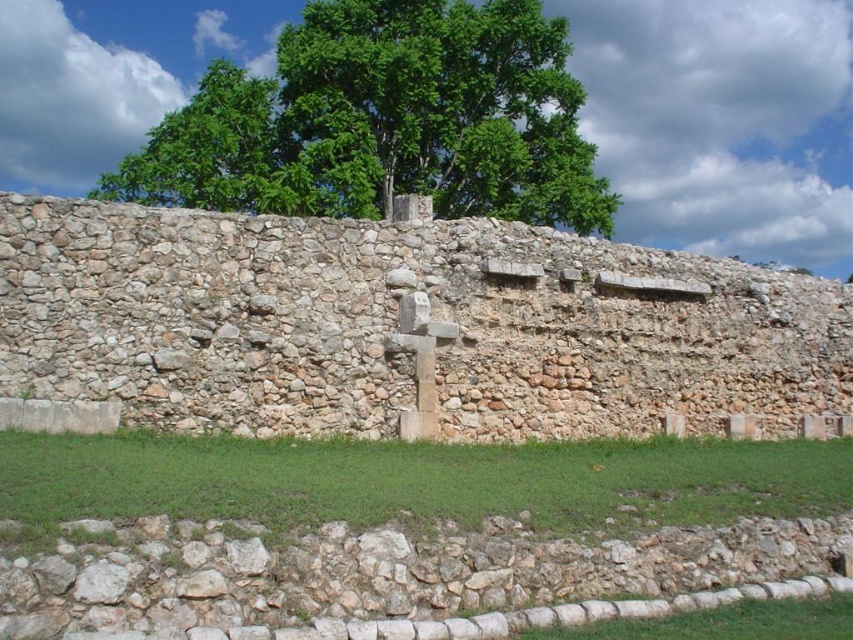
Does rustic stone wall at center have a larger size compared to smooth stone cross at center?

Indeed, rustic stone wall at center has a larger size compared to smooth stone cross at center.

Which is in front, point (281, 314) or point (434, 381)?

Point (281, 314) is in front.

Describe the element at coordinates (403, 326) in the screenshot. This screenshot has width=853, height=640. I see `rustic stone wall at center` at that location.

This screenshot has height=640, width=853. I want to click on rustic stone wall at center, so click(x=403, y=326).

Can you confirm if rustic stone wall at center is thinner than green leafy tree at upper center?

Yes, rustic stone wall at center is thinner than green leafy tree at upper center.

Between point (711, 336) and point (567, 208), which one is positioned in front?

Point (711, 336)

Which is behind, point (86, 211) or point (384, 157)?

The point (384, 157) is more distant.

Where is `rustic stone wall at center`? rustic stone wall at center is located at coordinates (403, 326).

Is green leafy tree at upper center smaller than smooth stone cross at center?

No, green leafy tree at upper center is not smaller than smooth stone cross at center.

Is green leafy tree at upper center bigger than smooth stone cross at center?

Yes, green leafy tree at upper center is bigger than smooth stone cross at center.

Locate an element on the screen. The image size is (853, 640). green leafy tree at upper center is located at coordinates (386, 120).

You are a GUI agent. You are given a task and a screenshot of the screen. Output one action in this format:
    pyautogui.click(x=<x>, y=<y>)
    Task: Click on the green leafy tree at upper center
    The width and height of the screenshot is (853, 640).
    Given the screenshot: What is the action you would take?
    pyautogui.click(x=386, y=120)